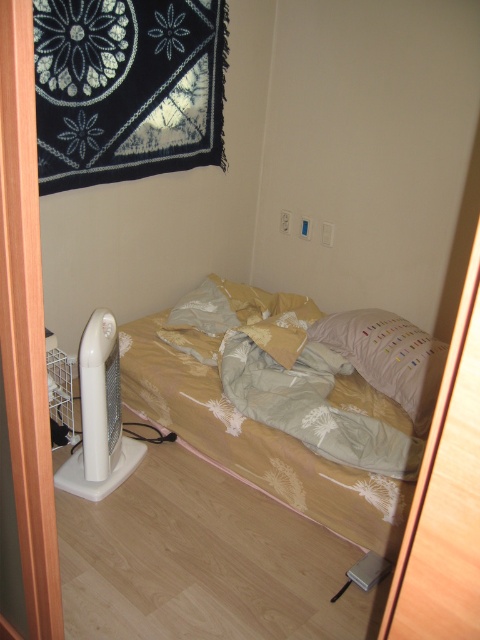
You are standing in the hallway outside the bedroom and want to enter. The door is partially open, allowing you to see the light beige fabric bed at center and the white plastic fan at lower left. Which object is closer to the door when you enter?

The white plastic fan at lower left is closer to the door because it is positioned to the left of the light beige fabric bed at center, which would place it nearer to the entrance when entering from the hallway.

You are standing in front of the bedroom door and want to make your bed. Where should you go to find the light beige fabric bed at center?

The light beige fabric bed at center is located at the center of the room, so you should go to the center of the room to find it.

From the picture: You are moving a small plant pot into the room. The plant pot is 0.5 meters wide. You want to place it on the floor between the light beige floral fabric at center and the white plastic fan at lower left. Is there enough space between them for the plant pot?

The light beige floral fabric at center is larger in size than the white plastic fan at lower left. However, the exact distance between them isn